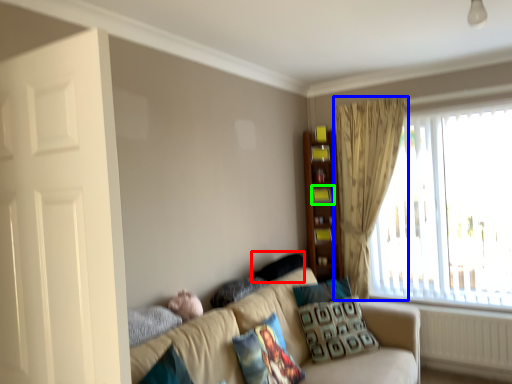
Question: Which object is the closest to the pillow (highlighted by a red box)? Choose among these: curtain (highlighted by a blue box) or shelf (highlighted by a green box).

Choices:
 (A) curtain
 (B) shelf

Answer: (B)